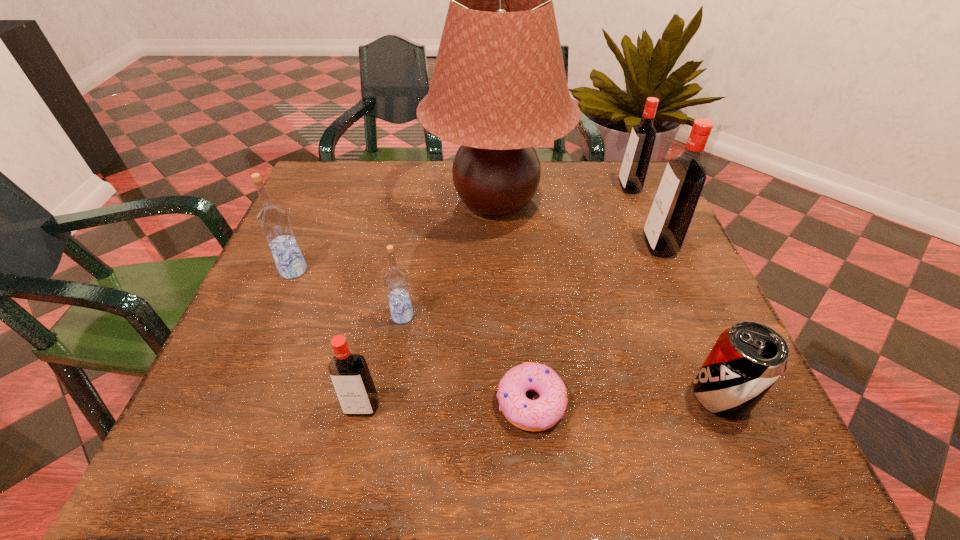
The image size is (960, 540). I want to click on the second nearest vodka, so click(395, 279).

Where is `the smaller blue vodka`? the smaller blue vodka is located at coordinates (395, 279).

You are a GUI agent. You are given a task and a screenshot of the screen. Output one action in this format:
    pyautogui.click(x=<x>, y=<y>)
    Task: Click on the second shortest object
    This screenshot has width=960, height=540.
    Given the screenshot: What is the action you would take?
    pyautogui.click(x=747, y=359)

Locate an element on the screen. the shortest object is located at coordinates (543, 413).

Where is `doughnut`? doughnut is located at coordinates point(543,413).

Identify the location of vacant space located 0.320m on the front-facing side of the lampshade. (301, 202).

The width and height of the screenshot is (960, 540). Find the location of `vacant space situated on the front-facing side of the lampshade`. vacant space situated on the front-facing side of the lampshade is located at coordinates (337, 202).

I want to click on free point located on the front-facing side of the lampshade, so click(387, 202).

Find the location of a particular element. free space located 0.140m on the front and back of the tallest vodka is located at coordinates (584, 246).

I want to click on free space located 0.170m on the front and back of the tallest vodka, so click(571, 246).